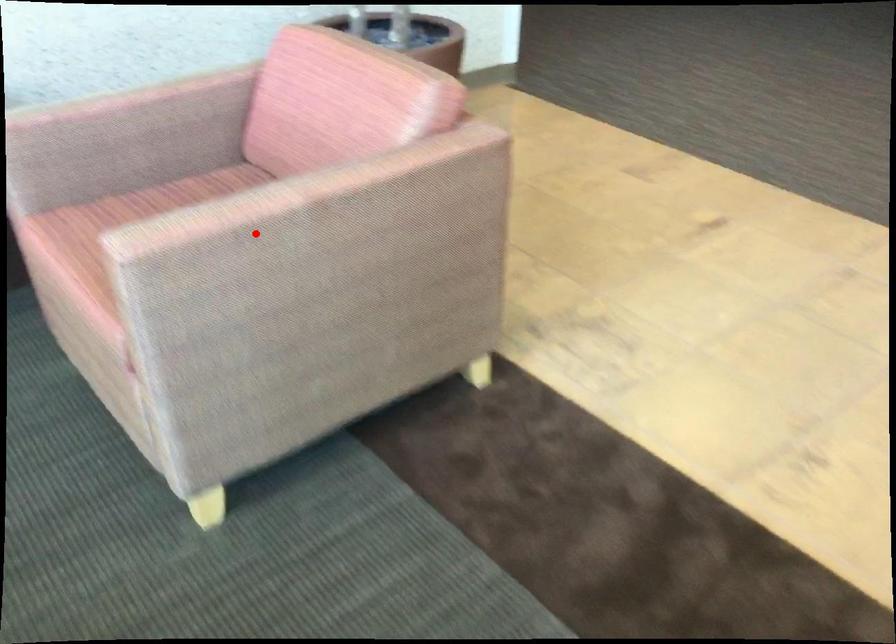
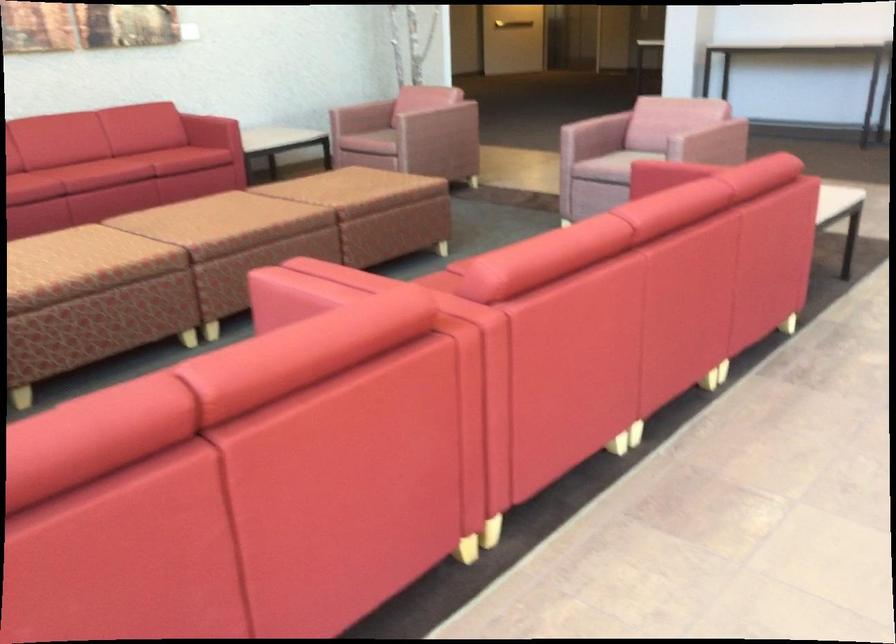
Question: I am providing you with two images of the same scene from different viewpoints. A red point is shown in image1. For the corresponding object point in image2, is it positioned nearer or farther from the camera?

Choices:
 (A) Nearer
 (B) Farther

Answer: (B)